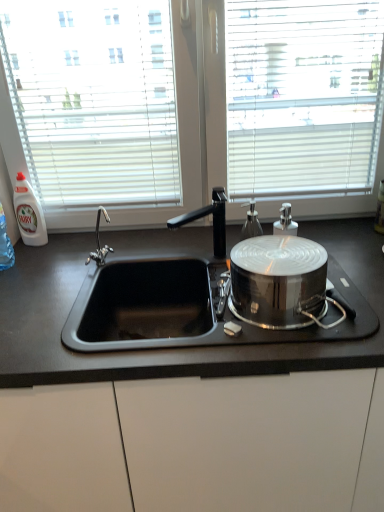
Locate an element on the screen. The width and height of the screenshot is (384, 512). free space in front of white plastic bottle at left, the 2th bottle in the front-to-back sequence is located at coordinates (37, 259).